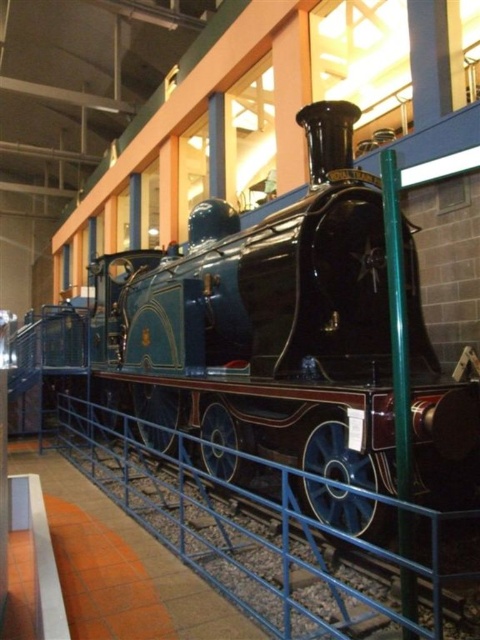
You are a museum guide explaining the exhibits to visitors. You point to the glossy black train at center and the blue metal rail at lower center. Which object would you describe as bigger?

The glossy black train at center is larger in size than the blue metal rail at lower center.

You are a visitor standing in front of the glossy black train at center and the blue metal rail at lower center. Which object is closer to you?

The glossy black train at center is closer to you than the blue metal rail at lower center.